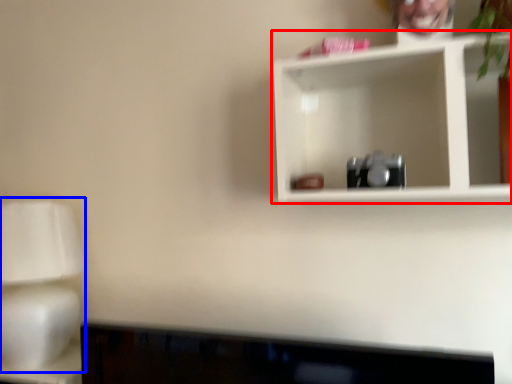
Question: Which of the following is the closest to the observer, shelf (highlighted by a red box) or table lamp (highlighted by a blue box)?

Choices:
 (A) shelf
 (B) table lamp

Answer: (A)